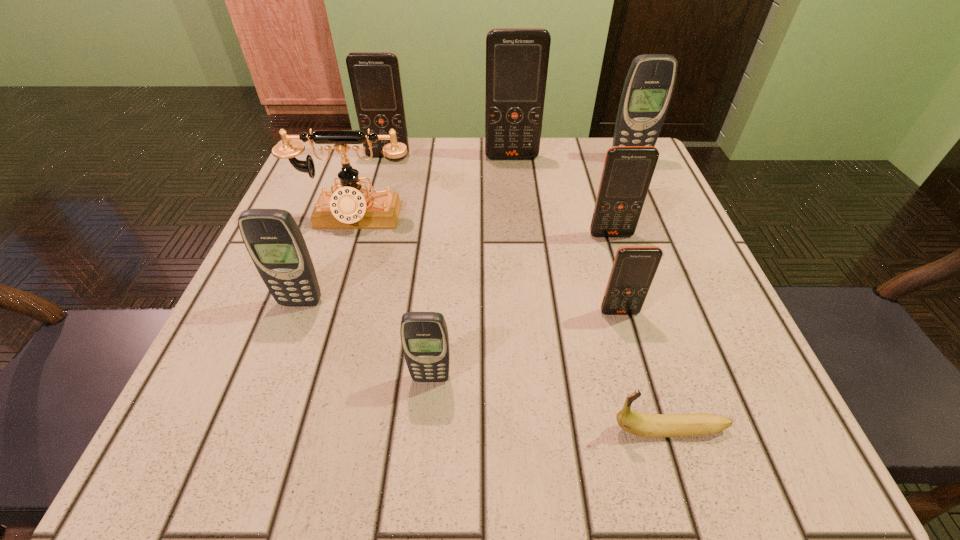
You are a GUI agent. You are given a task and a screenshot of the screen. Output one action in this format:
    pyautogui.click(x=<x>, y=<y>)
    Task: Click on the free space located on the screen of the third farthest orange cellular telephone
    This screenshot has width=960, height=540.
    Given the screenshot: What is the action you would take?
    pyautogui.click(x=648, y=353)

Identify the location of free space located 0.090m on the dial of the telephone. (339, 269).

Where is `vacant region located on the screen of the smallest orange cellular telephone`? This screenshot has width=960, height=540. vacant region located on the screen of the smallest orange cellular telephone is located at coordinates (657, 443).

The image size is (960, 540). I want to click on blank space located on the screen of the eighth farthest object, so click(x=422, y=473).

At what (x,y) coordinates should I click in order to perform the action: click on free space located 0.270m at the stem of the banana. Please return your answer as a coordinate pair (x, y). Looking at the image, I should click on (396, 429).

This screenshot has width=960, height=540. Find the location of `free spot located 0.180m at the stem of the banana`. free spot located 0.180m at the stem of the banana is located at coordinates (468, 429).

At what (x,y) coordinates should I click in order to perform the action: click on vacant space situated at the stem of the banana. Please return your answer as a coordinate pair (x, y). Looking at the image, I should click on (540, 429).

Find the location of a particular element. object present at the near edge is located at coordinates (642, 424).

Identify the location of telephone at the left edge. (350, 207).

This screenshot has height=540, width=960. Identify the location of banana at the right edge. (642, 424).